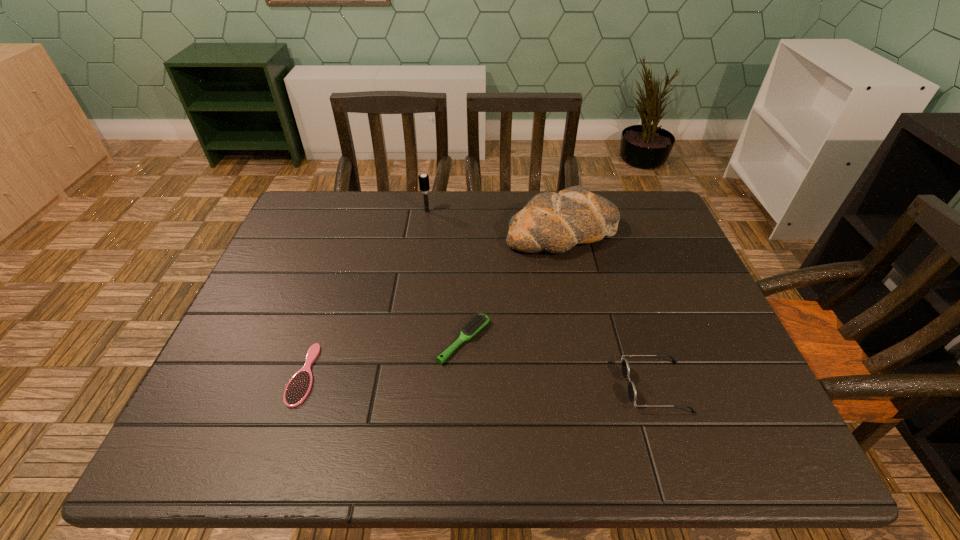
The width and height of the screenshot is (960, 540). What are the coordinates of `free location located on the front-facing side of the sunglasses` in the screenshot? It's located at (601, 387).

Image resolution: width=960 pixels, height=540 pixels. Find the location of `vacant space located on the front-facing side of the sunglasses`. vacant space located on the front-facing side of the sunglasses is located at coordinates (547, 387).

What are the coordinates of `free space located on the front-facing side of the sunglasses` in the screenshot? It's located at (566, 387).

Identify the location of free space located on the left of the second shortest hairbrush. This screenshot has width=960, height=540. (292, 341).

The height and width of the screenshot is (540, 960). What are the coordinates of `vacant area situated 0.120m on the back of the shortest hairbrush` in the screenshot? It's located at (327, 305).

This screenshot has height=540, width=960. I want to click on hairbrush located in the far edge section of the desktop, so click(424, 183).

Find the location of a particular element. bread that is positioned at the far edge is located at coordinates (555, 222).

Where is `bread that is at the right edge`? bread that is at the right edge is located at coordinates click(555, 222).

Where is `sunglasses located at the right edge`? This screenshot has height=540, width=960. sunglasses located at the right edge is located at coordinates (632, 393).

Locate an element on the screen. The height and width of the screenshot is (540, 960). object that is at the far right corner is located at coordinates (555, 222).